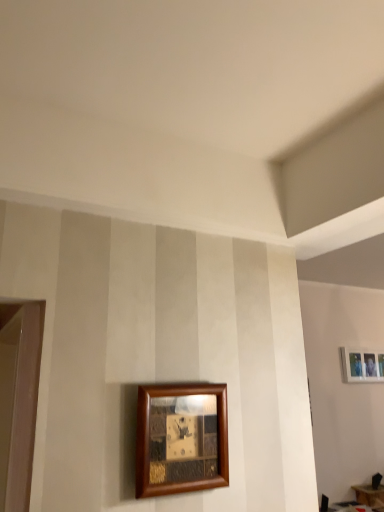
Question: Which direction should I rotate to look at wooden picture frame at lower center, the first picture frame from the front, — up or down?

Choices:
 (A) up
 (B) down

Answer: (B)

Question: Does wooden picture frame at lower center, the second picture frame positioned from the back, have a lesser width compared to wooden table at lower right?

Choices:
 (A) no
 (B) yes

Answer: (B)

Question: Can you confirm if wooden picture frame at lower center, the 1th picture frame when ordered from top to bottom, is shorter than wooden table at lower right?

Choices:
 (A) yes
 (B) no

Answer: (B)

Question: Considering the relative sizes of wooden picture frame at lower center, the 1th picture frame when ordered from top to bottom, and wooden table at lower right in the image provided, is wooden picture frame at lower center, the 1th picture frame when ordered from top to bottom, wider than wooden table at lower right?

Choices:
 (A) yes
 (B) no

Answer: (B)

Question: Can you confirm if wooden picture frame at lower center, the 1th picture frame when ordered from top to bottom, is taller than wooden table at lower right?

Choices:
 (A) no
 (B) yes

Answer: (B)

Question: Is wooden picture frame at lower center, marked as the 2th picture frame in a right-to-left arrangement, bigger than wooden table at lower right?

Choices:
 (A) yes
 (B) no

Answer: (B)

Question: From a real-world perspective, is wooden picture frame at lower center, the first picture frame from the left, under wooden table at lower right?

Choices:
 (A) no
 (B) yes

Answer: (A)

Question: Is wooden table at lower right touching wooden picture frame at lower center, the first picture frame from the front?

Choices:
 (A) no
 (B) yes

Answer: (A)

Question: Is wooden table at lower right facing away from wooden picture frame at lower center, which is the second picture frame in bottom-to-top order?

Choices:
 (A) no
 (B) yes

Answer: (A)

Question: Is wooden table at lower right thinner than wooden picture frame at lower center, the first picture frame from the front?

Choices:
 (A) no
 (B) yes

Answer: (A)

Question: Does wooden table at lower right appear on the left side of wooden picture frame at lower center, marked as the 2th picture frame in a right-to-left arrangement?

Choices:
 (A) no
 (B) yes

Answer: (A)

Question: Does wooden table at lower right have a smaller size compared to wooden picture frame at lower center, which is the second picture frame in bottom-to-top order?

Choices:
 (A) yes
 (B) no

Answer: (B)

Question: Is wooden table at lower right further to the viewer compared to wooden picture frame at lower center, the first picture frame from the front?

Choices:
 (A) yes
 (B) no

Answer: (A)

Question: Does wooden picture frame at lower center, marked as the 2th picture frame in a right-to-left arrangement, appear on the left side of white matte picture frame at upper right, which is counted as the second picture frame, starting from the top?

Choices:
 (A) no
 (B) yes

Answer: (B)